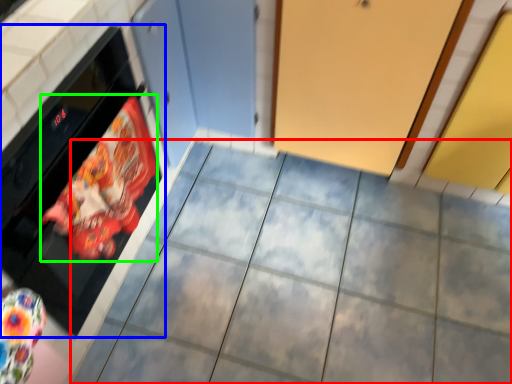
Question: Which is farther away from ceramic tile (highlighted by a red box)? oven (highlighted by a blue box) or material (highlighted by a green box)?

Choices:
 (A) oven
 (B) material

Answer: (A)